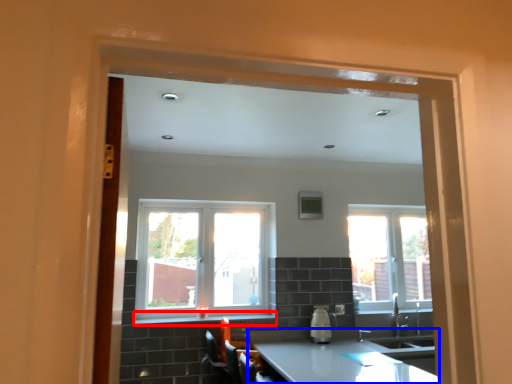
Question: Which object is closer to the camera taking this photo, window sill (highlighted by a red box) or countertop (highlighted by a blue box)?

Choices:
 (A) window sill
 (B) countertop

Answer: (B)